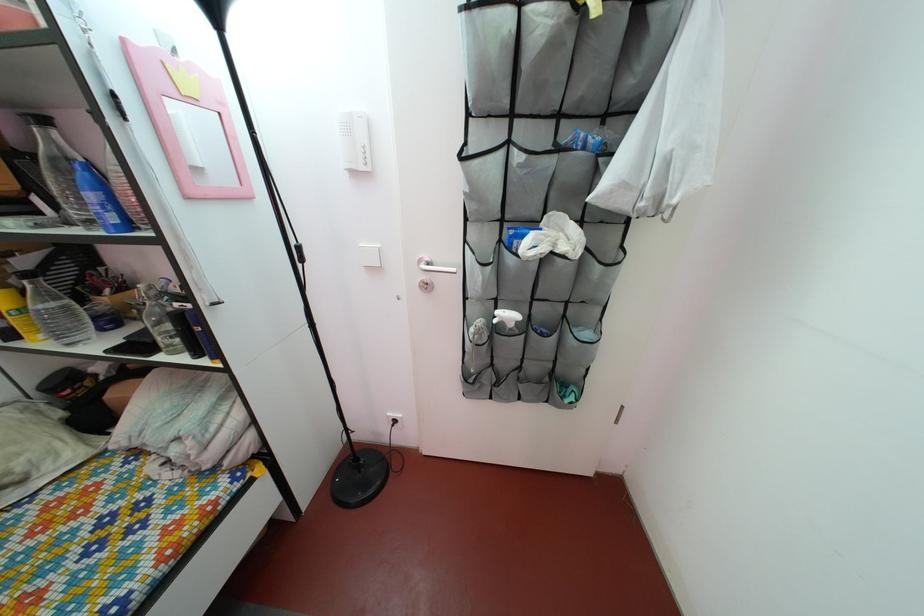
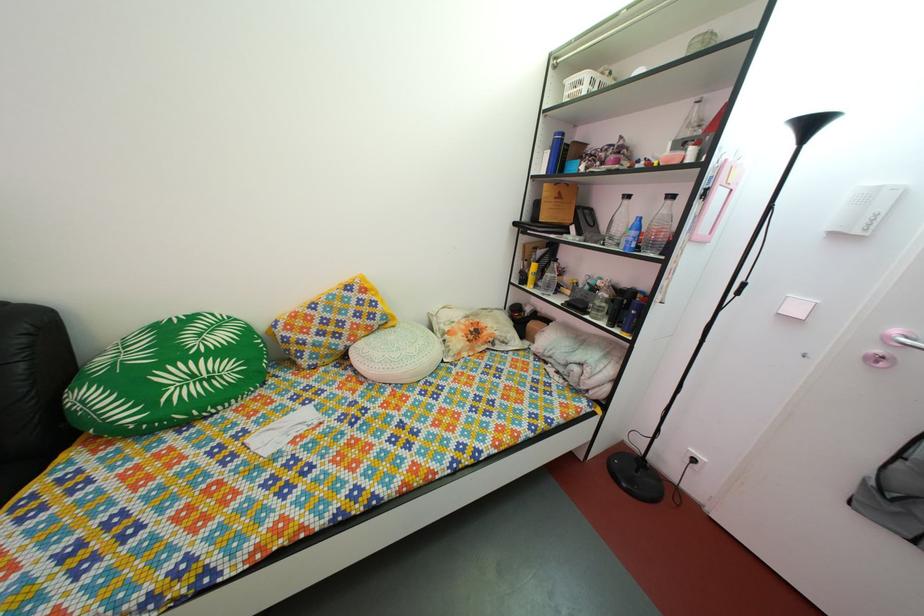
Find the pixel in the second image that matches the point at 27,330 in the first image.

(540, 286)